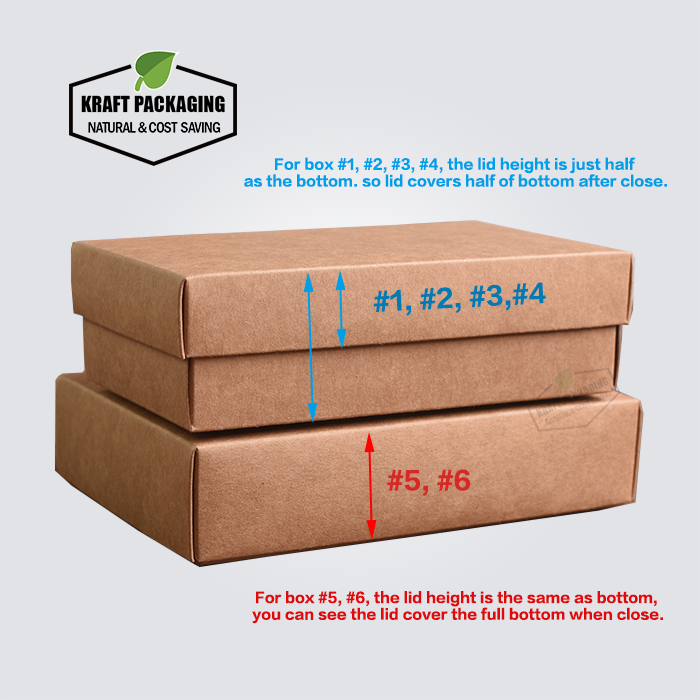
This screenshot has height=700, width=700. What are the coordinates of `2 boxes` in the screenshot? It's located at (250, 516), (246, 327).